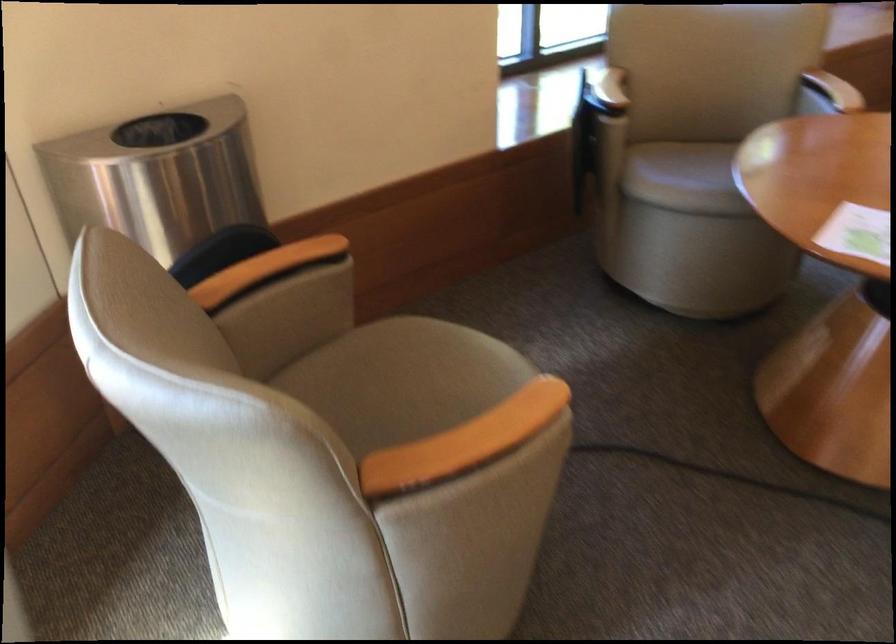
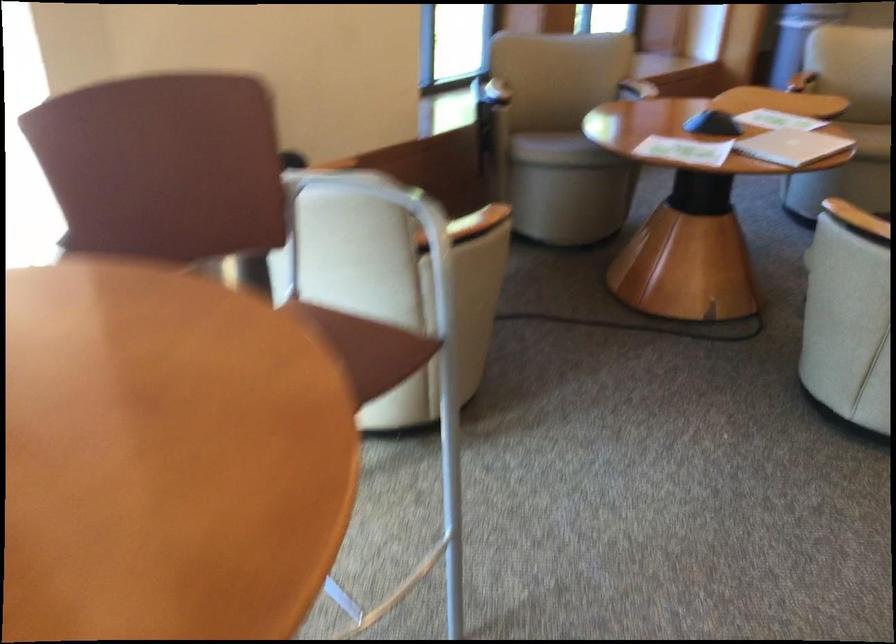
The point at (691, 200) is marked in the first image. Where is the corresponding point in the second image?

(561, 149)